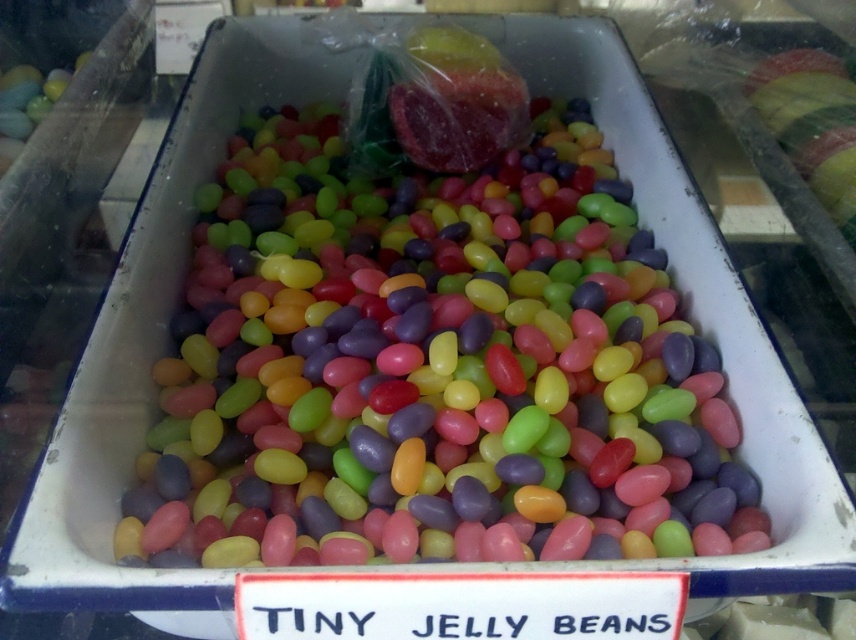
Question: Considering the real-world distances, which object is closest to the glossy jelly beans at center?

Choices:
 (A) matte plastic eggs at upper left
 (B) shiny metallic apple at upper right

Answer: (B)

Question: Where is shiny metallic apple at upper right located in relation to matte plastic eggs at upper left in the image?

Choices:
 (A) right
 (B) left

Answer: (A)

Question: Which point appears closest to the camera in this image?

Choices:
 (A) (28, 104)
 (B) (455, 448)

Answer: (B)

Question: Does shiny metallic apple at upper right have a larger size compared to matte plastic eggs at upper left?

Choices:
 (A) no
 (B) yes

Answer: (B)

Question: Estimate the real-world distances between objects in this image. Which object is closer to the shiny metallic apple at upper right?

Choices:
 (A) matte plastic eggs at upper left
 (B) glossy jelly beans at center

Answer: (B)

Question: Is glossy jelly beans at center smaller than matte plastic eggs at upper left?

Choices:
 (A) no
 (B) yes

Answer: (A)